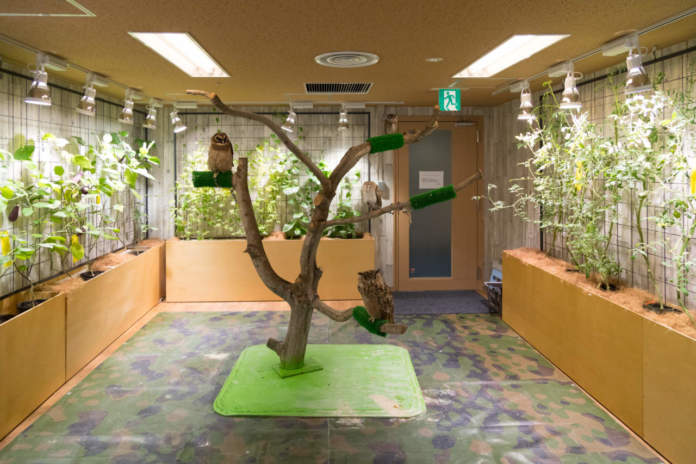
Locate an element on the screen. planter box is located at coordinates (47, 376), (116, 324), (207, 269), (564, 317), (665, 396).